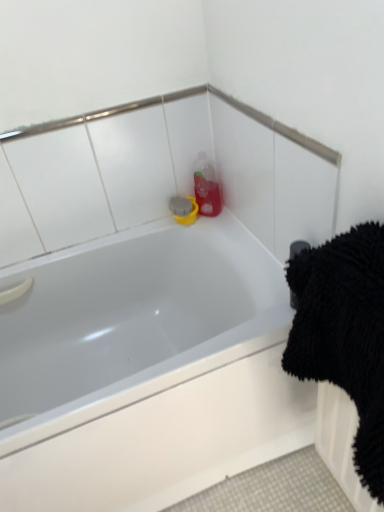
What is the approximate width of black rubber towel bar at upper right?

It is 6.67 centimeters.

This screenshot has height=512, width=384. Find the location of `white glossy bathtub at upper center`. white glossy bathtub at upper center is located at coordinates pyautogui.click(x=146, y=369).

From the image's perspective, which one is positioned lower, black fluffy bath towel at right or white glossy bathtub at upper center?

white glossy bathtub at upper center, from the image's perspective.

Which object is closer to the camera taking this photo, black fluffy bath towel at right or white glossy bathtub at upper center?

black fluffy bath towel at right is in front.

This screenshot has width=384, height=512. In order to click on bathtub on the left of black fluffy bath towel at right in this screenshot , I will do [x=146, y=369].

Is point (315, 350) in front of point (277, 276)?

Yes, it is in front of point (277, 276).

Can you confirm if white glossy bathtub at upper center is positioned to the right of black rubber towel bar at upper right?

No, white glossy bathtub at upper center is not to the right of black rubber towel bar at upper right.

How different are the orientations of white glossy bathtub at upper center and black rubber towel bar at upper right in degrees?

The angular difference between white glossy bathtub at upper center and black rubber towel bar at upper right is 89.2 degrees.

Considering the sizes of objects white glossy bathtub at upper center and black rubber towel bar at upper right in the image provided, who is bigger, white glossy bathtub at upper center or black rubber towel bar at upper right?

white glossy bathtub at upper center.

Considering the points (136, 466) and (290, 302), which point is in front, point (136, 466) or point (290, 302)?

The point (136, 466) is closer to the camera.

Between black rubber towel bar at upper right and white glossy bathtub at upper center, which one appears on the left side from the viewer's perspective?

white glossy bathtub at upper center is more to the left.

Considering their positions, is black rubber towel bar at upper right located in front of or behind white glossy bathtub at upper center?

Visually, black rubber towel bar at upper right is located behind white glossy bathtub at upper center.

Is black rubber towel bar at upper right not close to white glossy bathtub at upper center?

black rubber towel bar at upper right is near white glossy bathtub at upper center, not far away.

From the image's perspective, is black rubber towel bar at upper right located beneath white glossy bathtub at upper center?

Incorrect, from the image's perspective, black rubber towel bar at upper right is higher than white glossy bathtub at upper center.

Can you confirm if black fluffy bath towel at right is positioned to the left of black rubber towel bar at upper right?

In fact, black fluffy bath towel at right is to the right of black rubber towel bar at upper right.

In terms of height, does black fluffy bath towel at right look taller or shorter compared to black rubber towel bar at upper right?

Clearly, black fluffy bath towel at right is taller compared to black rubber towel bar at upper right.

Choose the correct answer: Is black fluffy bath towel at right inside black rubber towel bar at upper right or outside it?

black fluffy bath towel at right is outside black rubber towel bar at upper right.

From a real-world perspective, which object stands above the other?

From a 3D spatial view, black fluffy bath towel at right is above.

From the image's perspective, which object appears higher, white glossy bathtub at upper center or black fluffy bath towel at right?

black fluffy bath towel at right.

Are white glossy bathtub at upper center and black fluffy bath towel at right located far from each other?

No.

Could you tell me if white glossy bathtub at upper center is turned towards black fluffy bath towel at right?

Yes.

From a real-world perspective, which object rests below the other?

black fluffy bath towel at right is physically lower.

From the image's perspective, would you say black rubber towel bar at upper right is shown under black fluffy bath towel at right?

Incorrect, from the image's perspective, black rubber towel bar at upper right is higher than black fluffy bath towel at right.

Does black rubber towel bar at upper right appear on the right side of black fluffy bath towel at right?

Incorrect, black rubber towel bar at upper right is not on the right side of black fluffy bath towel at right.

At what (x,y) coordinates should I click in order to perform the action: click on bathtub on the left side of black fluffy bath towel at right. Please return your answer as a coordinate pair (x, y). The height and width of the screenshot is (512, 384). Looking at the image, I should click on (146, 369).

Find the location of a particular element. This screenshot has height=512, width=384. towel bar lying on the right of white glossy bathtub at upper center is located at coordinates (297, 248).

Considering their positions, is white glossy bathtub at upper center positioned further to black fluffy bath towel at right than black rubber towel bar at upper right?

white glossy bathtub at upper center is further to black fluffy bath towel at right.

Looking at the image, which one is located further to black rubber towel bar at upper right, black fluffy bath towel at right or white glossy bathtub at upper center?

white glossy bathtub at upper center.

When comparing their distances from black rubber towel bar at upper right, does white glossy bathtub at upper center or black fluffy bath towel at right seem further?

The object further to black rubber towel bar at upper right is white glossy bathtub at upper center.

From the image, which object appears to be nearer to white glossy bathtub at upper center, black fluffy bath towel at right or black rubber towel bar at upper right?

The object closer to white glossy bathtub at upper center is black fluffy bath towel at right.

Based on their spatial positions, is black rubber towel bar at upper right or black fluffy bath towel at right further from white glossy bathtub at upper center?

The object further to white glossy bathtub at upper center is black rubber towel bar at upper right.

Looking at this image, from the image, which object appears to be farther from black fluffy bath towel at right, black rubber towel bar at upper right or white glossy bathtub at upper center?

white glossy bathtub at upper center lies further to black fluffy bath towel at right than the other object.

Identify the location of towel bar between white glossy bathtub at upper center and black fluffy bath towel at right. This screenshot has height=512, width=384. (297, 248).